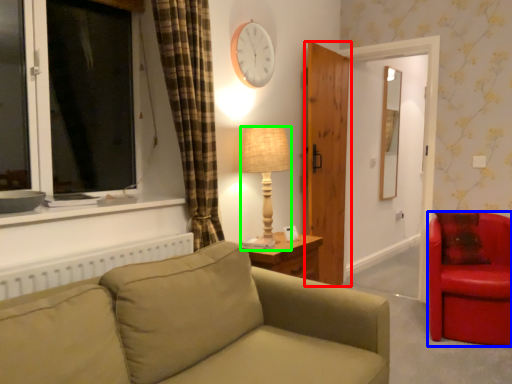
Question: Considering the real-world distances, which object is farthest from door (highlighted by a red box)? chair (highlighted by a blue box) or lamp (highlighted by a green box)?

Choices:
 (A) chair
 (B) lamp

Answer: (A)